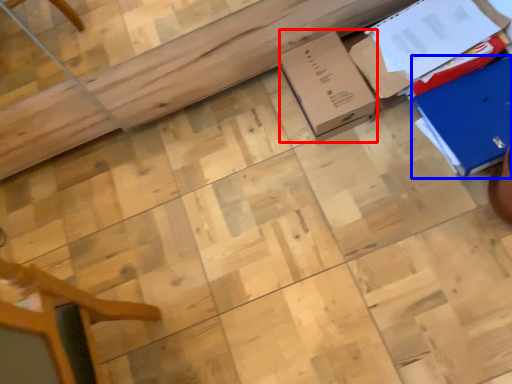
Question: Which point is further to the camera, cardboard box (highlighted by a red box) or cardboard box (highlighted by a blue box)?

Choices:
 (A) cardboard box
 (B) cardboard box

Answer: (A)